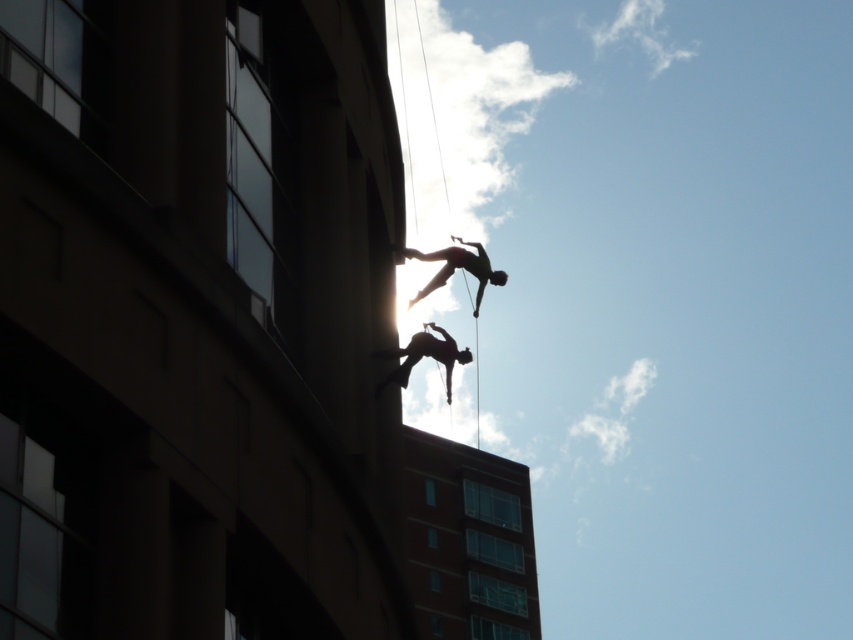
Question: Is silhouette fabric climber at center positioned in front of silhouette fabric at upper center?

Choices:
 (A) no
 (B) yes

Answer: (B)

Question: Can you confirm if silhouette fabric climber at center is positioned above silhouette fabric at upper center?

Choices:
 (A) no
 (B) yes

Answer: (A)

Question: Observing the image, what is the correct spatial positioning of silhouette fabric climber at center in reference to silhouette fabric at upper center?

Choices:
 (A) above
 (B) below

Answer: (B)